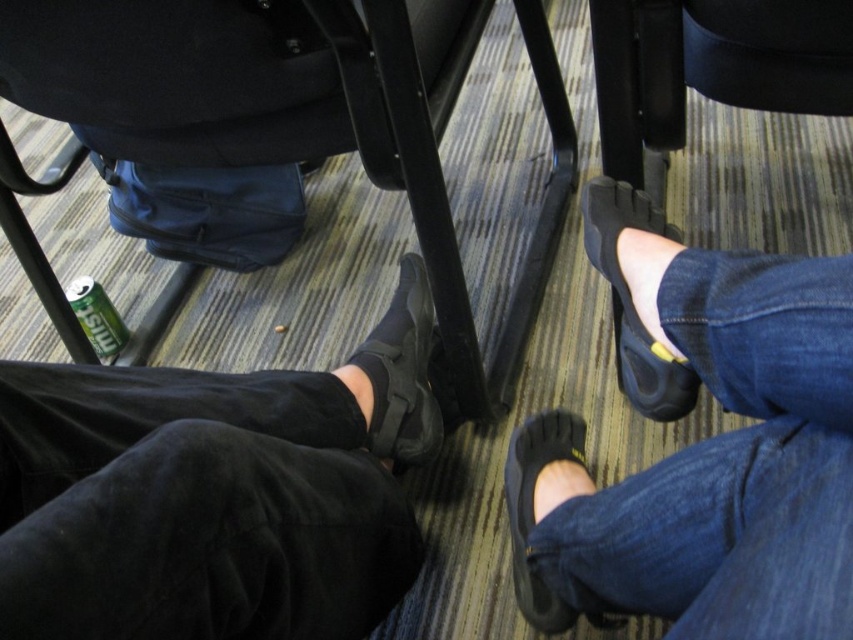
Which is more to the right, black suede shoes at lower left or black suede shoe at lower right?

From the viewer's perspective, black suede shoe at lower right appears more on the right side.

Which is below, black suede shoes at lower left or black suede shoe at lower right?

black suede shoe at lower right is below.

I want to click on black suede shoes at lower left, so click(212, 493).

Identify the location of black suede shoes at lower left. The width and height of the screenshot is (853, 640). (212, 493).

Is black suede shoes at lower left below black plastic chair at lower left?

Yes.

Is black suede shoes at lower left above black plastic chair at lower left?

Actually, black suede shoes at lower left is below black plastic chair at lower left.

Does point (294, 576) come behind point (296, 141)?

No, (294, 576) is closer to viewer.

Where is `black suede shoes at lower left`? black suede shoes at lower left is located at coordinates (212, 493).

Is point (561, 528) more distant than point (363, 161)?

No, (561, 528) is closer to viewer.

Is black suede shoes at lower right above black plastic chair at lower left?

Incorrect, black suede shoes at lower right is not positioned above black plastic chair at lower left.

Does point (657, 248) come closer to viewer compared to point (492, 380)?

Yes.

You are a GUI agent. You are given a task and a screenshot of the screen. Output one action in this format:
    pyautogui.click(x=<x>, y=<y>)
    Task: Click on the black suede shoes at lower right
    This screenshot has height=640, width=853.
    Given the screenshot: What is the action you would take?
    pyautogui.click(x=701, y=448)